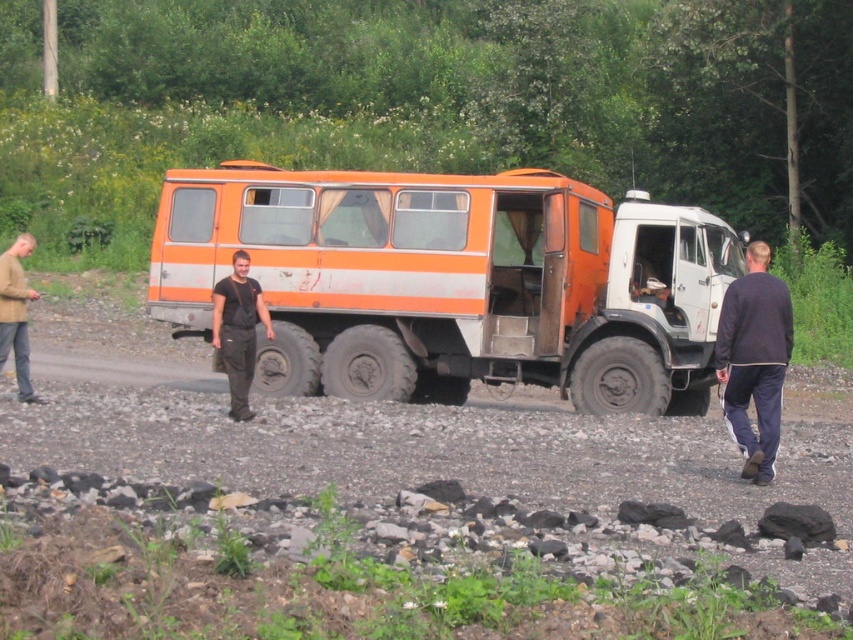
Which is behind, point (723, 342) or point (33, 396)?

The point (33, 396) is behind.

From the picture: Does dark blue sweatshirt at right appear over light brown sweater at left?

Incorrect, dark blue sweatshirt at right is not positioned above light brown sweater at left.

Find the location of a particular element. This screenshot has height=640, width=853. dark blue sweatshirt at right is located at coordinates (x=753, y=358).

Is orange matte truck at center positioned in front of light brown sweater at left?

That is False.

Is point (326, 317) behind point (15, 330)?

Yes, point (326, 317) is farther from viewer.

Describe the element at coordinates (451, 282) in the screenshot. I see `orange matte truck at center` at that location.

The height and width of the screenshot is (640, 853). I want to click on orange matte truck at center, so click(x=451, y=282).

Does orange matte truck at center have a smaller size compared to dark blue sweatshirt at right?

Yes.

Between orange matte truck at center and dark blue sweatshirt at right, which one is positioned higher?

dark blue sweatshirt at right is above.

Between point (515, 176) and point (747, 422), which one is positioned behind?

Point (515, 176)

In order to click on orange matte truck at center in this screenshot , I will do `click(451, 282)`.